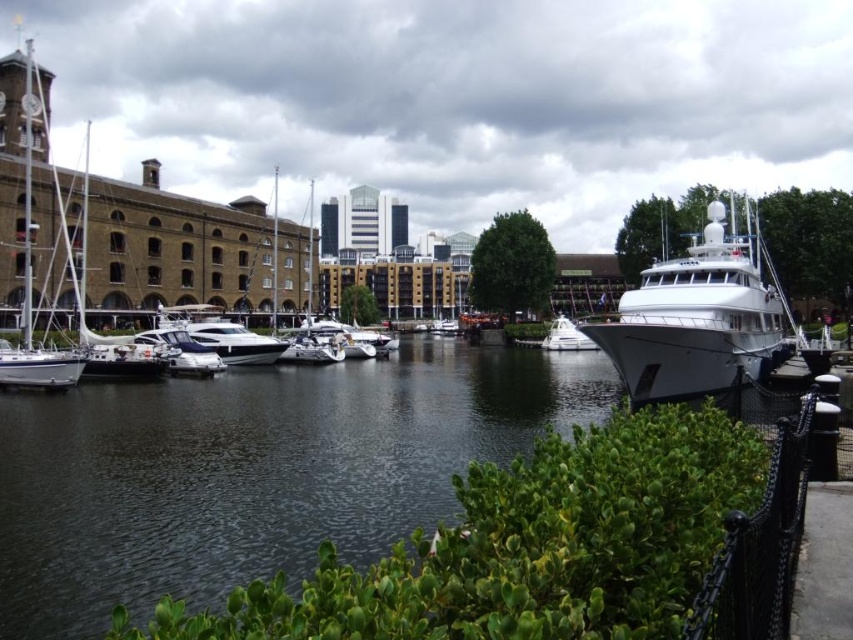
Who is lower down, dark blue water at center or white glossy yacht at right?

Positioned lower is dark blue water at center.

Image resolution: width=853 pixels, height=640 pixels. What do you see at coordinates (253, 472) in the screenshot?
I see `dark blue water at center` at bounding box center [253, 472].

Between point (190, 408) and point (683, 378), which one is positioned behind?

Positioned behind is point (190, 408).

I want to click on dark blue water at center, so click(253, 472).

Is point (665, 340) positioned behind point (181, 326)?

No, it is in front of (181, 326).

Is white glossy yacht at right below shiny white yacht at center?

Incorrect, white glossy yacht at right is not positioned below shiny white yacht at center.

Which is in front, point (665, 301) or point (233, 328)?

Point (665, 301) is more forward.

Image resolution: width=853 pixels, height=640 pixels. What are the coordinates of `white glossy yacht at right` in the screenshot? It's located at (697, 320).

Is dark blue water at center thinner than white glossy sailboat at left?

Incorrect, dark blue water at center's width is not less than white glossy sailboat at left's.

Looking at this image, does dark blue water at center appear over white glossy sailboat at left?

Incorrect, dark blue water at center is not positioned above white glossy sailboat at left.

Is point (193, 452) more distant than point (25, 205)?

That is False.

At what (x,y) coordinates should I click in order to perform the action: click on dark blue water at center. Please return your answer as a coordinate pair (x, y). Image resolution: width=853 pixels, height=640 pixels. Looking at the image, I should click on (253, 472).